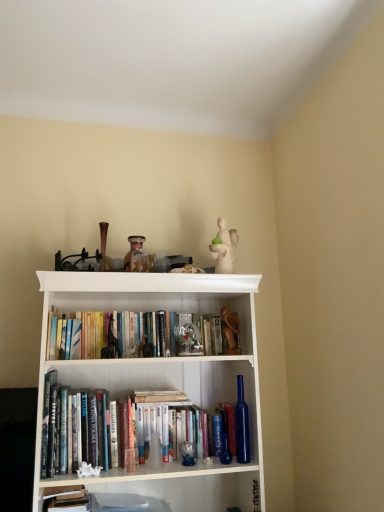
What do you see at coordinates (133, 250) in the screenshot? I see `matte glass jar at upper center, the 1th toy in the left-to-right sequence` at bounding box center [133, 250].

The image size is (384, 512). What do you see at coordinates (224, 247) in the screenshot? I see `white porcelain figurine at upper center, arranged as the first toy when viewed from the top` at bounding box center [224, 247].

What do you see at coordinates (230, 331) in the screenshot?
I see `wooden figurine at center, the 3th toy in the left-to-right sequence` at bounding box center [230, 331].

Measure the distance between hardcover book at lower left, the first book viewed from the front, and camera.

hardcover book at lower left, the first book viewed from the front, and camera are 5.48 feet apart.

Image resolution: width=384 pixels, height=512 pixels. What do you see at coordinates (155, 385) in the screenshot? I see `white wood bookshelf at center` at bounding box center [155, 385].

The image size is (384, 512). I want to click on white wood bookshelf at center, so click(155, 385).

Measure the distance between hardcover books at center, arranged as the 1th book when viewed from the back, and camera.

hardcover books at center, arranged as the 1th book when viewed from the back, and camera are 1.68 meters apart.

Find the location of a particular element. The image size is (384, 512). hardcover books at center, acting as the second book starting from the bottom is located at coordinates (112, 335).

Where is `matte glass jar at upper center, positioned as the 2th toy in top-to-bottom order`? This screenshot has width=384, height=512. matte glass jar at upper center, positioned as the 2th toy in top-to-bottom order is located at coordinates (133, 250).

Between white wood bookshelf at center and blue glass bottle at lower center, which one has smaller size?

blue glass bottle at lower center.

Based on the photo, is white wood bookshelf at center not close to blue glass bottle at lower center?

No, white wood bookshelf at center is in close proximity to blue glass bottle at lower center.

Choose the correct answer: Is white wood bookshelf at center inside blue glass bottle at lower center or outside it?

white wood bookshelf at center cannot be found inside blue glass bottle at lower center.

From the image's perspective, which is below, white wood bookshelf at center or blue glass bottle at lower center?

blue glass bottle at lower center appears lower in the image.

Are blue glass bottle at lower center and matte glass jar at upper center, positioned as the 2th toy in top-to-bottom order, located far from each other?

Actually, blue glass bottle at lower center and matte glass jar at upper center, positioned as the 2th toy in top-to-bottom order, are a little close together.

Does blue glass bottle at lower center contain matte glass jar at upper center, positioned as the 2th toy in top-to-bottom order?

No, matte glass jar at upper center, positioned as the 2th toy in top-to-bottom order, is located outside of blue glass bottle at lower center.

How different are the orientations of blue glass bottle at lower center and matte glass jar at upper center, which is counted as the 2th toy, starting from the bottom, in degrees?

The angular difference between blue glass bottle at lower center and matte glass jar at upper center, which is counted as the 2th toy, starting from the bottom, is 4.3 degrees.

Considering the relative positions of blue glass bottle at lower center and matte glass jar at upper center, the 3th toy from the right, in the image provided, is blue glass bottle at lower center to the left or to the right of matte glass jar at upper center, the 3th toy from the right,?

blue glass bottle at lower center is to the right of matte glass jar at upper center, the 3th toy from the right.

Is hardcover book at lower left, the 1th book when ordered from bottom to top, beside white wood bookshelf at center?

hardcover book at lower left, the 1th book when ordered from bottom to top, is not next to white wood bookshelf at center, and they're not touching.

Between hardcover book at lower left, the 1th book when ordered from bottom to top, and white wood bookshelf at center, which one has less height?

hardcover book at lower left, the 1th book when ordered from bottom to top.

From a real-world perspective, which object rests below the other?

In real-world perspective, hardcover book at lower left, which is the second book in top-to-bottom order, is lower.

Looking at their sizes, would you say hardcover book at lower left, the first book viewed from the front, is wider or thinner than white wood bookshelf at center?

Considering their sizes, hardcover book at lower left, the first book viewed from the front, looks slimmer than white wood bookshelf at center.

Relative to white wood bookshelf at center, is white porcelain figurine at upper center, which is counted as the second toy, starting from the left, in front or behind?

Visually, white porcelain figurine at upper center, which is counted as the second toy, starting from the left, is located behind white wood bookshelf at center.

Measure the distance between white porcelain figurine at upper center, the third toy positioned from the bottom, and white wood bookshelf at center.

white porcelain figurine at upper center, the third toy positioned from the bottom, and white wood bookshelf at center are 24.36 inches apart.

Considering the relative positions of white porcelain figurine at upper center, the third toy positioned from the bottom, and white wood bookshelf at center in the image provided, is white porcelain figurine at upper center, the third toy positioned from the bottom, to the left of white wood bookshelf at center from the viewer's perspective?

Incorrect, white porcelain figurine at upper center, the third toy positioned from the bottom, is not on the left side of white wood bookshelf at center.

Which of these two, white porcelain figurine at upper center, arranged as the first toy when viewed from the top, or white wood bookshelf at center, is thinner?

Thinner between the two is white porcelain figurine at upper center, arranged as the first toy when viewed from the top.

Is point (224, 248) in front of point (46, 497)?

No, it is behind (46, 497).

Considering the sizes of objects white porcelain figurine at upper center, arranged as the first toy when viewed from the top, and hardcover book at lower left, the 2th book when ordered from back to front, in the image provided, who is shorter, white porcelain figurine at upper center, arranged as the first toy when viewed from the top, or hardcover book at lower left, the 2th book when ordered from back to front,?

Standing shorter between the two is hardcover book at lower left, the 2th book when ordered from back to front.

From a real-world perspective, is white porcelain figurine at upper center, the second toy viewed from the right, above or below hardcover book at lower left, the 2th book when ordered from back to front?

white porcelain figurine at upper center, the second toy viewed from the right, is situated higher than hardcover book at lower left, the 2th book when ordered from back to front, in the real world.

Which object is further away from the camera taking this photo, white porcelain figurine at upper center, the third toy positioned from the bottom, or hardcover book at lower left, which is the second book in top-to-bottom order?

white porcelain figurine at upper center, the third toy positioned from the bottom, is further from the camera.

Is blue glass bottle at lower center oriented towards white porcelain figurine at upper center, the third toy positioned from the bottom?

No, blue glass bottle at lower center is not aimed at white porcelain figurine at upper center, the third toy positioned from the bottom.

Could white porcelain figurine at upper center, arranged as the first toy when viewed from the top, be considered to be inside blue glass bottle at lower center?

No, blue glass bottle at lower center does not contain white porcelain figurine at upper center, arranged as the first toy when viewed from the top.

Between blue glass bottle at lower center and white porcelain figurine at upper center, the third toy positioned from the bottom, which one has smaller width?

With smaller width is blue glass bottle at lower center.

Considering the positions of objects hardcover books at center, acting as the second book starting from the bottom, and wooden figurine at center, the third toy positioned from the top, in the image provided, who is behind, hardcover books at center, acting as the second book starting from the bottom, or wooden figurine at center, the third toy positioned from the top,?

Positioned behind is wooden figurine at center, the third toy positioned from the top.

In terms of height, does hardcover books at center, arranged as the 1th book when viewed from the back, look taller or shorter compared to wooden figurine at center, the 3th toy in the left-to-right sequence?

Clearly, hardcover books at center, arranged as the 1th book when viewed from the back, is shorter compared to wooden figurine at center, the 3th toy in the left-to-right sequence.

From a real-world perspective, relative to wooden figurine at center, the 1th toy ordered from the bottom, is hardcover books at center, acting as the second book starting from the bottom, vertically above or below?

hardcover books at center, acting as the second book starting from the bottom, is above wooden figurine at center, the 1th toy ordered from the bottom.

Is hardcover books at center, arranged as the 1th book when viewed from the back, facing towards wooden figurine at center, arranged as the 1th toy when viewed from the right?

Yes, hardcover books at center, arranged as the 1th book when viewed from the back, is oriented towards wooden figurine at center, arranged as the 1th toy when viewed from the right.

Identify the location of bottle on the right of white wood bookshelf at center. This screenshot has width=384, height=512. (242, 425).

The image size is (384, 512). I want to click on bottle below the matte glass jar at upper center, positioned as the 2th toy in top-to-bottom order (from the image's perspective), so click(x=242, y=425).

Which object lies further to the anchor point blue glass bottle at lower center, white porcelain figurine at upper center, which is counted as the second toy, starting from the left, or white wood bookshelf at center?

white porcelain figurine at upper center, which is counted as the second toy, starting from the left, lies further to blue glass bottle at lower center than the other object.

Looking at the image, which one is located closer to hardcover books at center, which is counted as the 2th book, starting from the front, hardcover book at lower left, which is the second book in top-to-bottom order, or wooden figurine at center, arranged as the 1th toy when viewed from the right?

wooden figurine at center, arranged as the 1th toy when viewed from the right, lies closer to hardcover books at center, which is counted as the 2th book, starting from the front, than the other object.

From the image, which object appears to be nearer to hardcover book at lower left, the first book viewed from the front, blue glass bottle at lower center or wooden figurine at center, the 1th toy ordered from the bottom?

Among the two, blue glass bottle at lower center is located nearer to hardcover book at lower left, the first book viewed from the front.

When comparing their distances from hardcover books at center, which is counted as the 2th book, starting from the front, does wooden figurine at center, the third toy positioned from the top, or matte glass jar at upper center, the 1th toy in the left-to-right sequence, seem closer?

matte glass jar at upper center, the 1th toy in the left-to-right sequence, is positioned closer to the anchor hardcover books at center, which is counted as the 2th book, starting from the front.

Based on their spatial positions, is blue glass bottle at lower center or white wood bookshelf at center closer to hardcover books at center, the 1th book from the top?

white wood bookshelf at center lies closer to hardcover books at center, the 1th book from the top, than the other object.

Looking at the image, which one is located further to white porcelain figurine at upper center, the second toy viewed from the right, white wood bookshelf at center or wooden figurine at center, the third toy positioned from the top?

white wood bookshelf at center is positioned further to the anchor white porcelain figurine at upper center, the second toy viewed from the right.

Looking at the image, which one is located further to wooden figurine at center, the 1th toy ordered from the bottom, hardcover book at lower left, the 1th book when ordered from bottom to top, or white porcelain figurine at upper center, arranged as the first toy when viewed from the top?

The object further to wooden figurine at center, the 1th toy ordered from the bottom, is hardcover book at lower left, the 1th book when ordered from bottom to top.

Estimate the real-world distances between objects in this image. Which object is closer to blue glass bottle at lower center, white wood bookshelf at center or wooden figurine at center, the third toy positioned from the top?

The object closer to blue glass bottle at lower center is wooden figurine at center, the third toy positioned from the top.

Where is `shelf that lies between matte glass jar at upper center, positioned as the 2th toy in top-to-bottom order, and blue glass bottle at lower center from top to bottom`? The width and height of the screenshot is (384, 512). shelf that lies between matte glass jar at upper center, positioned as the 2th toy in top-to-bottom order, and blue glass bottle at lower center from top to bottom is located at coordinates (155, 385).

The image size is (384, 512). Find the location of `shelf between white porcelain figurine at upper center, the third toy positioned from the bottom, and blue glass bottle at lower center in the up-down direction`. shelf between white porcelain figurine at upper center, the third toy positioned from the bottom, and blue glass bottle at lower center in the up-down direction is located at coordinates (155, 385).

The height and width of the screenshot is (512, 384). I want to click on bottle that lies between white porcelain figurine at upper center, the second toy viewed from the right, and hardcover book at lower left, the 1th book when ordered from bottom to top, from top to bottom, so click(242, 425).

Image resolution: width=384 pixels, height=512 pixels. What are the coordinates of `toy between matte glass jar at upper center, the 3th toy from the right, and white wood bookshelf at center in the up-down direction` in the screenshot? It's located at (230, 331).